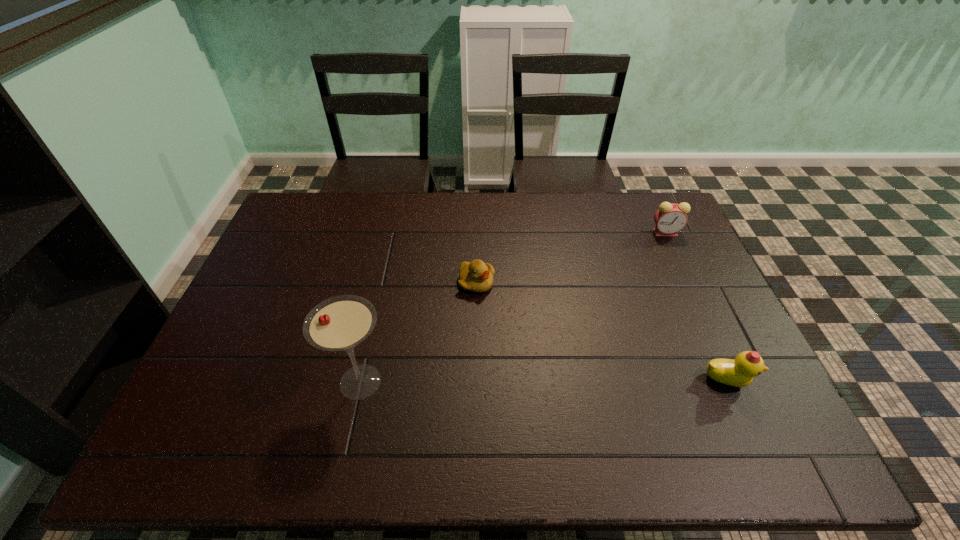
At what (x,y) coordinates should I click in order to perform the action: click on vacant space on the desktop that is between the martini and the taller duckling and is positioned at the beak of the shorter duckling. Please return your answer as a coordinate pair (x, y). Looking at the image, I should click on (586, 381).

Find the location of a particular element. This screenshot has height=540, width=960. vacant space on the desktop that is between the tallest object and the right duckling and is positioned on the face of the alarm clock is located at coordinates (516, 381).